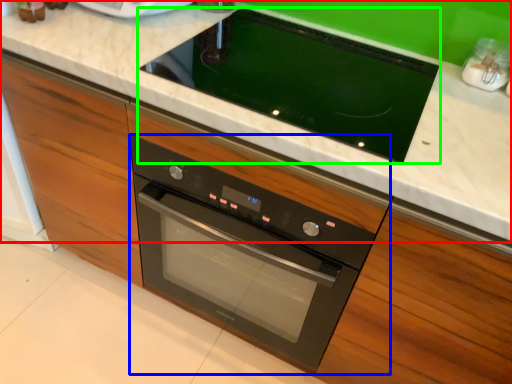
Question: Considering the real-world distances, which object is closest to countertop (highlighted by a red box)? oven (highlighted by a blue box) or home appliance (highlighted by a green box).

Choices:
 (A) oven
 (B) home appliance

Answer: (B)